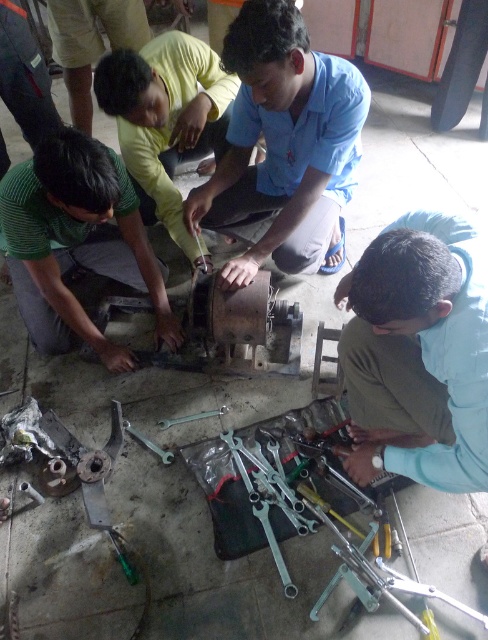
You are a new worker in the workshop and need to locate the light blue shirt at lower right and the green matte metal tool at lower left. Which object takes up more space in the image?

The green matte metal tool at lower left takes up more space in the image because the light blue shirt at lower right is smaller than it.

In the scene shown: You are standing in the workshop and see two points marked on the wall. The first point is at coordinate point [96,324] and the second at point [166,216]. If you want to touch both points starting from the nearest one, which point should you touch first?

You should touch point [96,324] first because it is closer to you than point [166,216], as stated in the description.

You are a mechanic working in the workshop. You need to reach the yellow matte shirt at center to hand over the green matte metal tool at lower left. Can you comfortably hand it over without moving your position?

The distance between the green matte metal tool at lower left and the yellow matte shirt at center is 14.94 inches, which is approximately 1.25 feet. Since this distance is within a typical arm reach, you can comfortably hand over the tool without moving your position.